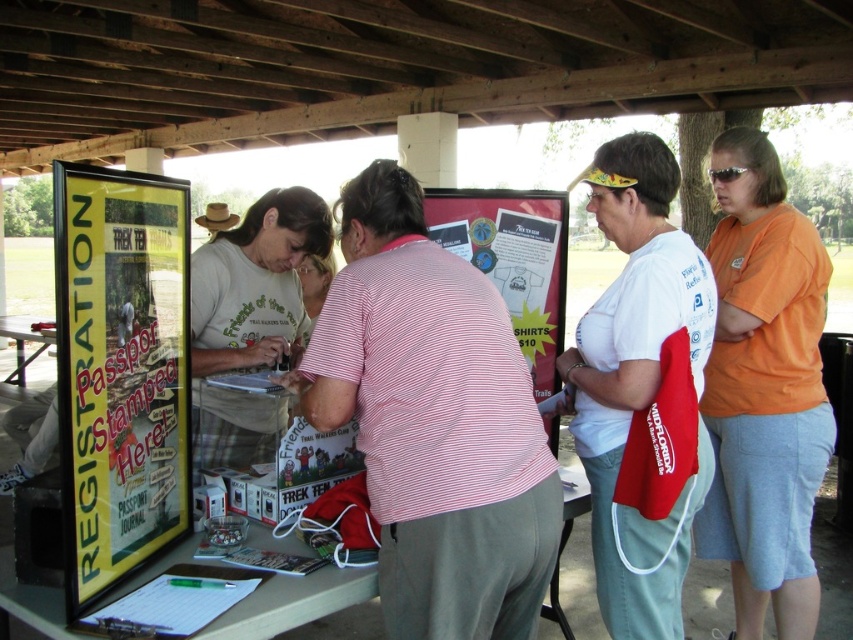
You need to place a 1.5 meter long banner on the white plastic table at center. Given the size of the striped cotton shirt at center, will the banner fit on the table?

The striped cotton shirt at center is less wide than the white plastic table at center, but the banner is 1.5 meters long. Since the table width isn

In the scene shown: You are standing at the edge of the grassy field and want to approach the registration table. You see the striped cotton shirt at center and the white plastic table at center. Which object should you head towards first to reach the registration area?

You should head towards the white plastic table at center first because the striped cotton shirt at center is to the right of it, meaning the table is closer to your current position at the edge of the field.

You are standing at the registration table and want to move towards the direction of point (45,339). Which direction should you walk relative to point (457,196)?

Since point (457,196) is in front of point (45,339), you should walk backward or behind the direction of point (457,196) to reach point (45,339).